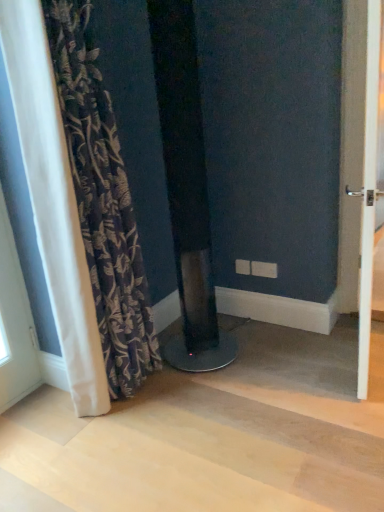
Question: Does dark floral fabric curtain at left have a greater height compared to white glossy door at right?

Choices:
 (A) no
 (B) yes

Answer: (B)

Question: Is dark floral fabric curtain at left not inside white glossy door at right?

Choices:
 (A) no
 (B) yes

Answer: (B)

Question: Does dark floral fabric curtain at left have a lesser width compared to white glossy door at right?

Choices:
 (A) yes
 (B) no

Answer: (B)

Question: Could you tell me if dark floral fabric curtain at left is facing white glossy door at right?

Choices:
 (A) yes
 (B) no

Answer: (B)

Question: Would you say white glossy door at right is part of dark floral fabric curtain at left's contents?

Choices:
 (A) yes
 (B) no

Answer: (B)

Question: Are dark floral fabric curtain at left and white glossy door at right beside each other?

Choices:
 (A) no
 (B) yes

Answer: (A)

Question: Is white glossy door at right oriented away from dark floral fabric curtain at left?

Choices:
 (A) yes
 (B) no

Answer: (A)

Question: Does white glossy door at right appear on the right side of dark floral fabric curtain at left?

Choices:
 (A) no
 (B) yes

Answer: (B)

Question: Is dark floral fabric curtain at left inside white glossy door at right?

Choices:
 (A) yes
 (B) no

Answer: (B)

Question: Can you confirm if white glossy door at right is thinner than dark floral fabric curtain at left?

Choices:
 (A) no
 (B) yes

Answer: (B)

Question: Is white glossy door at right to the left of dark floral fabric curtain at left from the viewer's perspective?

Choices:
 (A) yes
 (B) no

Answer: (B)

Question: Are white glossy door at right and dark floral fabric curtain at left making contact?

Choices:
 (A) yes
 (B) no

Answer: (B)

Question: From the image's perspective, is white glossy door at right above or below dark floral fabric curtain at left?

Choices:
 (A) below
 (B) above

Answer: (B)